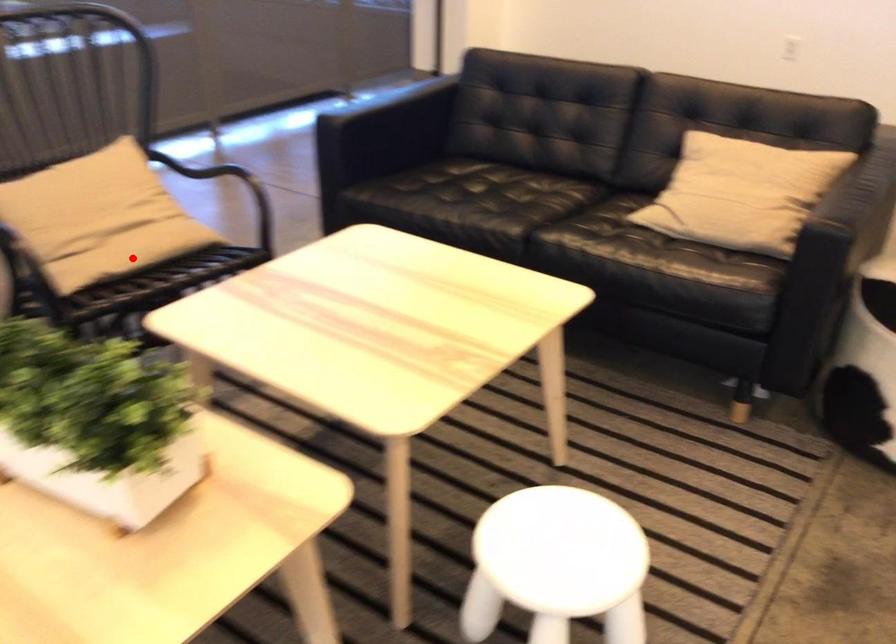
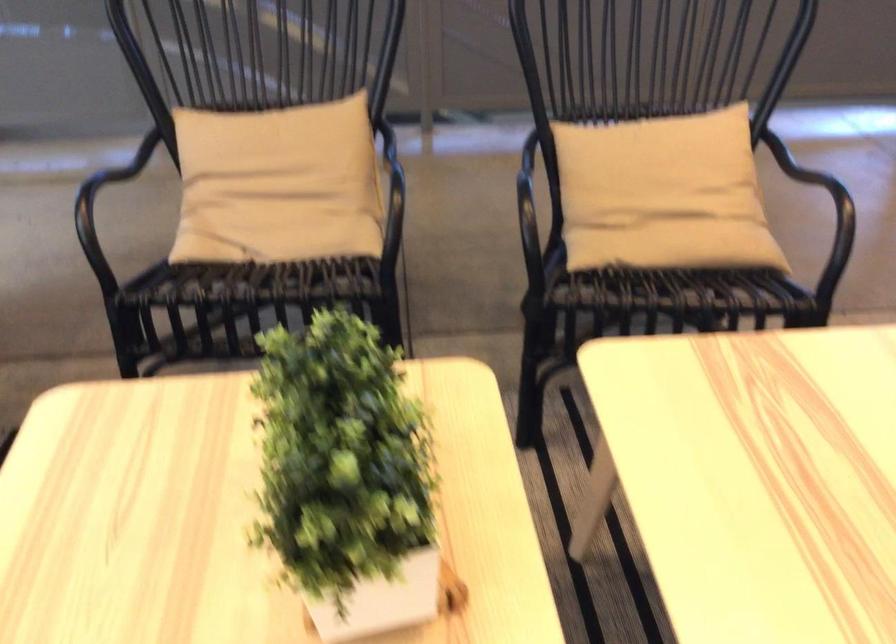
Locate, in the second image, the point that corresponds to the highlighted location in the first image.

(674, 245)